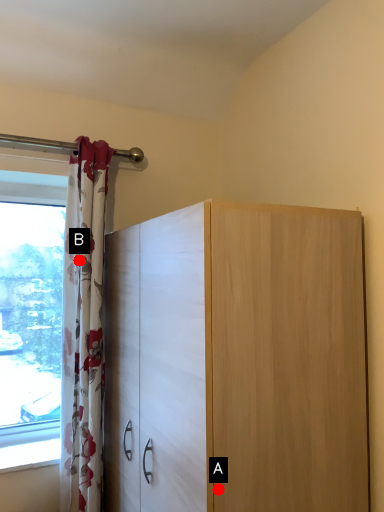
Question: Two points are circled on the image, labeled by A and B beside each circle. Which point is closer to the camera?

Choices:
 (A) A is closer
 (B) B is closer

Answer: (A)